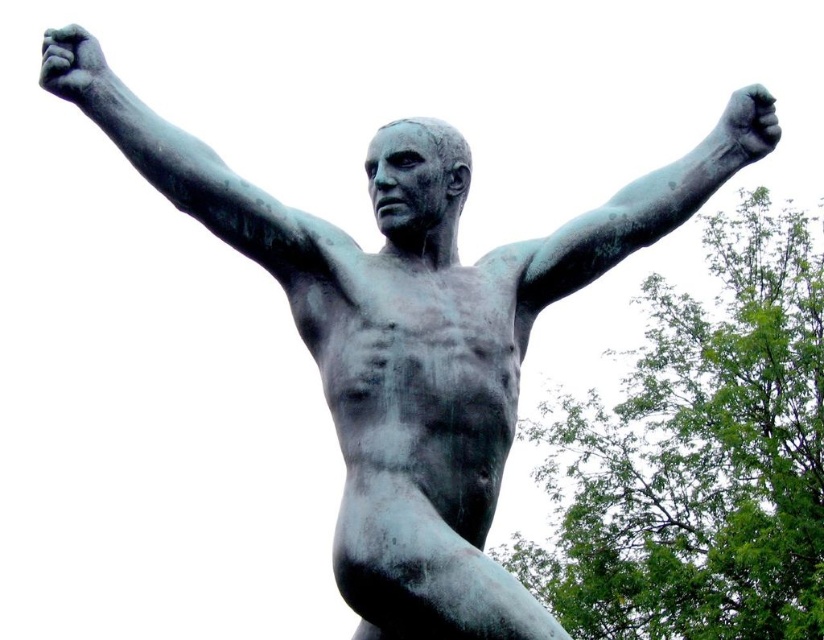
You are an art conservator examining the statue. You notice a specific point at coordinates point (x=190, y=168). Based on the image, what part of the statue does this point correspond to?

The point (x=190, y=168) corresponds to the bronze smooth arm at upper left.